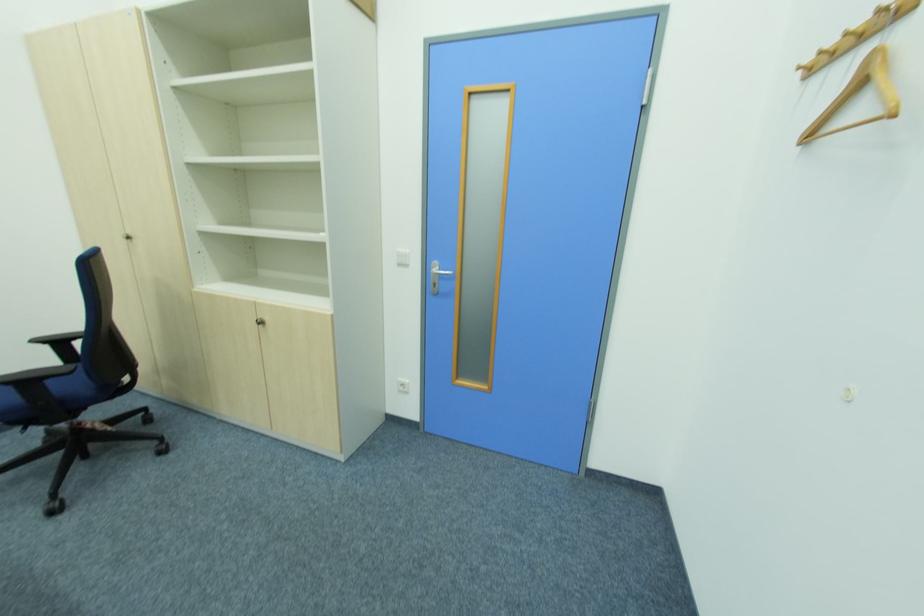
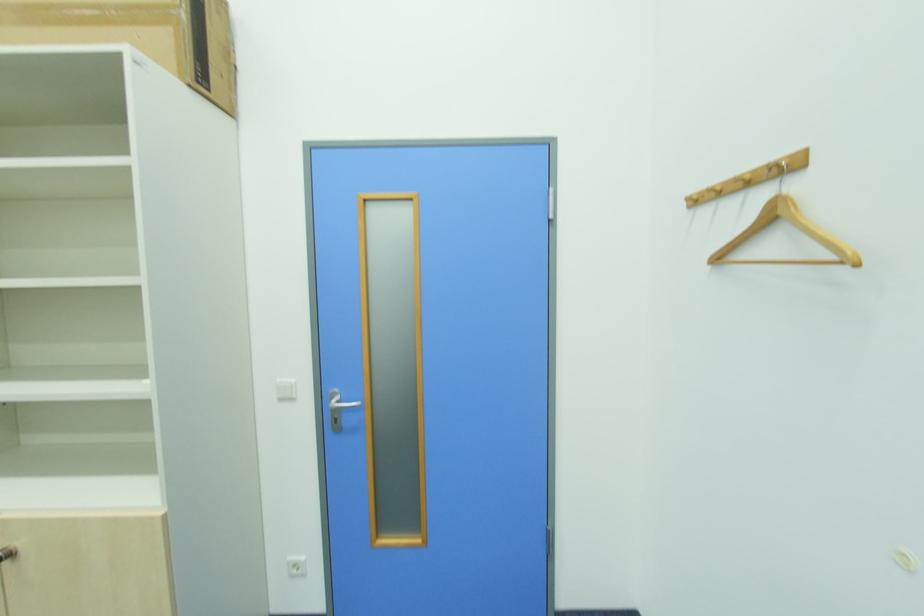
Question: What movement of the cameraman would produce the second image?

Choices:
 (A) Left
 (B) Right
 (C) Forward
 (D) Backward

Answer: (C)